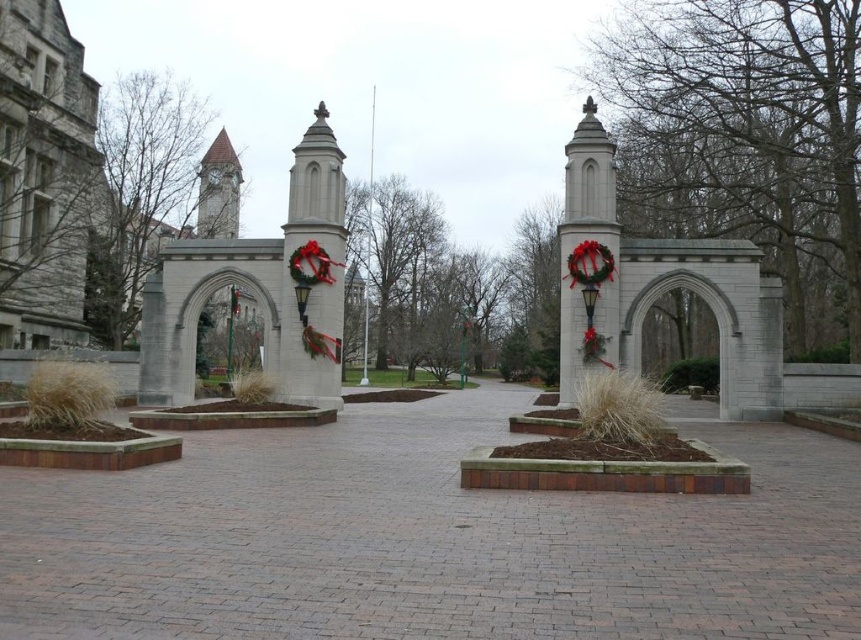
Question: Does smooth stone archway at center appear under white stone archway at right?

Choices:
 (A) no
 (B) yes

Answer: (A)

Question: Which point is closer to the camera?

Choices:
 (A) (209, 147)
 (B) (302, 321)
 (C) (760, 381)

Answer: (C)

Question: Which of these objects is positioned farthest from the white stone archway at right?

Choices:
 (A) smooth stone archway at center
 (B) brown stone clock tower at upper left

Answer: (B)

Question: Does smooth stone archway at center appear on the right side of brown stone clock tower at upper left?

Choices:
 (A) no
 (B) yes

Answer: (B)

Question: Can you confirm if white stone archway at right is thinner than brown stone clock tower at upper left?

Choices:
 (A) no
 (B) yes

Answer: (A)

Question: Which point appears farthest from the camera in this image?

Choices:
 (A) (301, 321)
 (B) (220, 192)

Answer: (B)